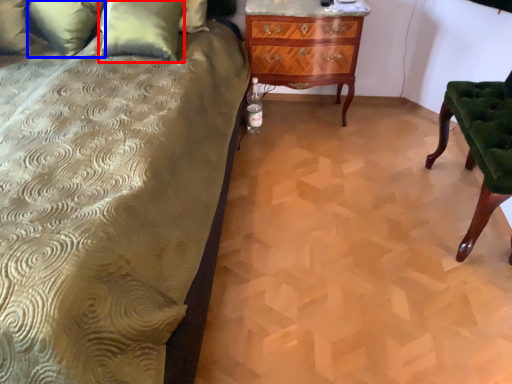
Question: Among these objects, which one is farthest to the camera, pillow (highlighted by a red box) or pillow (highlighted by a blue box)?

Choices:
 (A) pillow
 (B) pillow

Answer: (B)